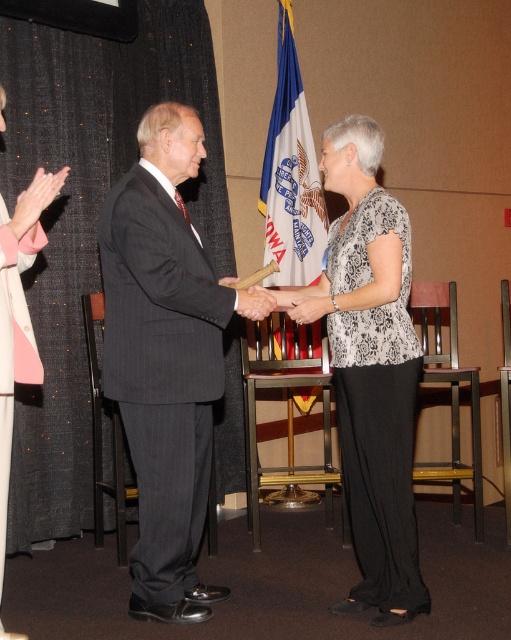
Can you confirm if dark gray pinstripe suit at center is shorter than white fabric flag at center?

In fact, dark gray pinstripe suit at center may be taller than white fabric flag at center.

Is dark gray pinstripe suit at center below white fabric flag at center?

Yes, dark gray pinstripe suit at center is below white fabric flag at center.

Is point (194, 573) closer to viewer compared to point (280, 198)?

Yes, it is.

Find the location of a particular element. The image size is (511, 640). dark gray pinstripe suit at center is located at coordinates (164, 358).

Does dark gray pinstripe suit at center lie behind black printed blouse at center?

Yes, dark gray pinstripe suit at center is behind black printed blouse at center.

Who is shorter, dark gray pinstripe suit at center or black printed blouse at center?

black printed blouse at center is shorter.

Describe the element at coordinates (164, 358) in the screenshot. I see `dark gray pinstripe suit at center` at that location.

Find the location of a particular element. Image resolution: width=511 pixels, height=640 pixels. dark gray pinstripe suit at center is located at coordinates (x=164, y=358).

Who is positioned more to the left, pink fabric at left or smooth wood hand at center?

pink fabric at left is more to the left.

Does pink fabric at left have a smaller size compared to smooth wood hand at center?

No.

Is point (1, 273) positioned in front of point (244, 307)?

That is True.

What are the coordinates of `pink fabric at left` in the screenshot? It's located at (18, 314).